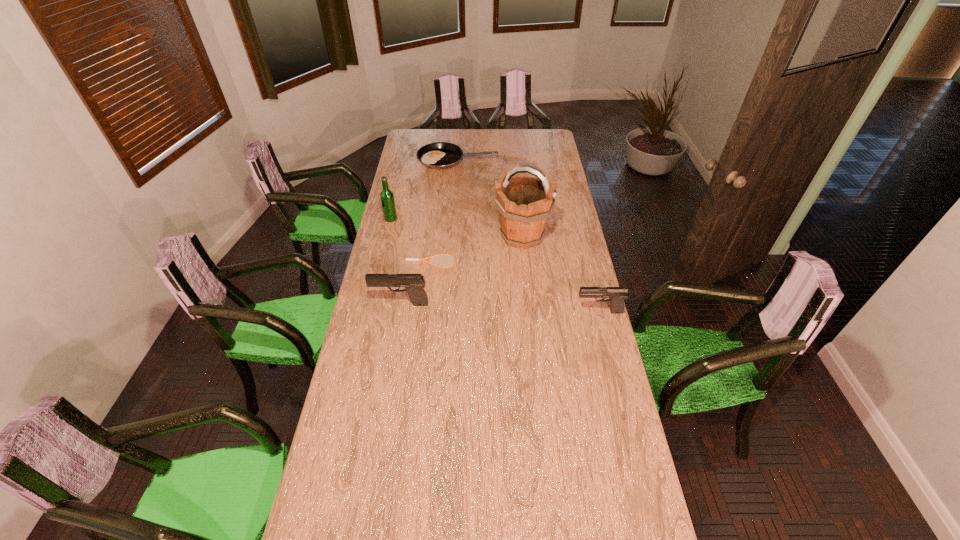
Find the location of a particular element. Image resolution: width=960 pixels, height=540 pixels. the taller pistol is located at coordinates (414, 283).

This screenshot has height=540, width=960. Find the location of `the fourth shortest object`. the fourth shortest object is located at coordinates (414, 283).

What are the coordinates of `the rightmost object` in the screenshot? It's located at (616, 295).

Where is `the nearest object`? the nearest object is located at coordinates (x=616, y=295).

Locate an element on the screen. This screenshot has width=960, height=540. the tallest object is located at coordinates (524, 203).

Find the location of a particular element. The height and width of the screenshot is (540, 960). the farthest object is located at coordinates (440, 155).

Image resolution: width=960 pixels, height=540 pixels. I want to click on frying pan, so click(440, 155).

You are a GUI agent. You are given a task and a screenshot of the screen. Output one action in this format:
    pyautogui.click(x=<x>, y=<y>)
    Task: Click on the beer bottle
    
    Given the screenshot: What is the action you would take?
    pyautogui.click(x=387, y=197)

At what (x,y) coordinates should I click in order to perform the action: click on tennis racket. Please return your answer as a coordinate pair (x, y). Looking at the image, I should click on (431, 257).

This screenshot has height=540, width=960. In order to click on blank space located 0.310m aim along the barrel of the shorter pistol in this screenshot , I will do `click(496, 312)`.